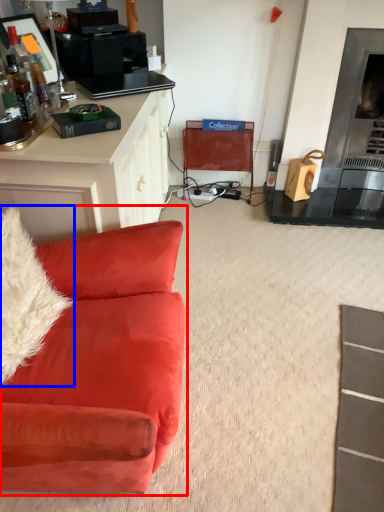
Question: Which object is closer to the camera taking this photo, studio couch (highlighted by a red box) or pillow (highlighted by a blue box)?

Choices:
 (A) studio couch
 (B) pillow

Answer: (A)